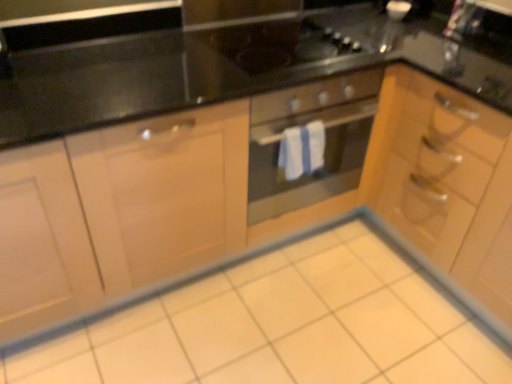
Question: Is black glass gas stove at center facing away from stainless steel oven at center?

Choices:
 (A) yes
 (B) no

Answer: (B)

Question: Does black glass gas stove at center turn towards stainless steel oven at center?

Choices:
 (A) yes
 (B) no

Answer: (B)

Question: Is black glass gas stove at center not inside stainless steel oven at center?

Choices:
 (A) no
 (B) yes

Answer: (B)

Question: Would you say stainless steel oven at center is part of black glass gas stove at center's contents?

Choices:
 (A) yes
 (B) no

Answer: (B)

Question: From a real-world perspective, is black glass gas stove at center positioned under stainless steel oven at center based on gravity?

Choices:
 (A) yes
 (B) no

Answer: (B)

Question: From a real-world perspective, is white glossy tile at center above or below black glass gas stove at center?

Choices:
 (A) below
 (B) above

Answer: (A)

Question: Is white glossy tile at center spatially inside black glass gas stove at center, or outside of it?

Choices:
 (A) outside
 (B) inside

Answer: (A)

Question: From the image's perspective, relative to black glass gas stove at center, is white glossy tile at center above or below?

Choices:
 (A) above
 (B) below

Answer: (B)

Question: Visually, is white glossy tile at center positioned to the left or to the right of black glass gas stove at center?

Choices:
 (A) right
 (B) left

Answer: (B)

Question: Considering the positions of black glass gas stove at center and stainless steel oven at center in the image, is black glass gas stove at center wider or thinner than stainless steel oven at center?

Choices:
 (A) wide
 (B) thin

Answer: (B)

Question: From the image's perspective, is black glass gas stove at center above or below stainless steel oven at center?

Choices:
 (A) above
 (B) below

Answer: (A)

Question: Is black glass gas stove at center inside or outside of stainless steel oven at center?

Choices:
 (A) inside
 (B) outside

Answer: (B)

Question: In the image, is black glass gas stove at center positioned in front of or behind stainless steel oven at center?

Choices:
 (A) behind
 (B) front

Answer: (A)

Question: In the image, is black glass gas stove at center positioned in front of or behind white glossy tile at center?

Choices:
 (A) behind
 (B) front

Answer: (A)

Question: Looking at the image, does black glass gas stove at center seem bigger or smaller compared to white glossy tile at center?

Choices:
 (A) big
 (B) small

Answer: (B)